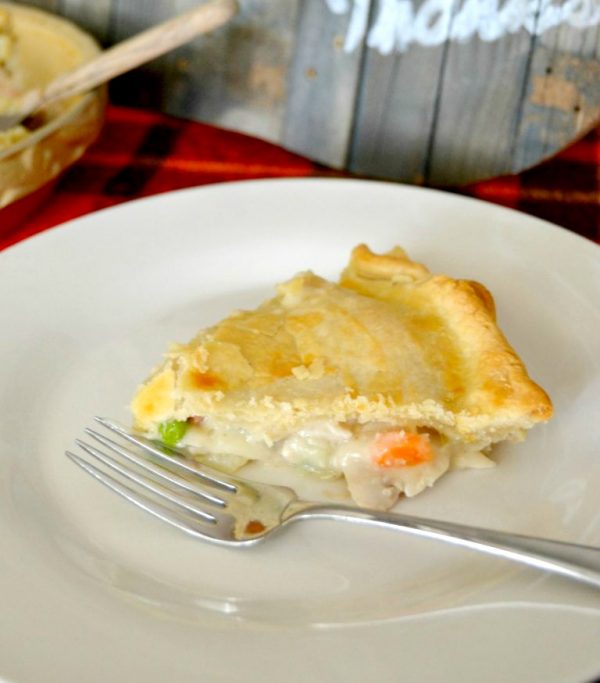
Identify the location of table cloth. (179, 166), (566, 199).